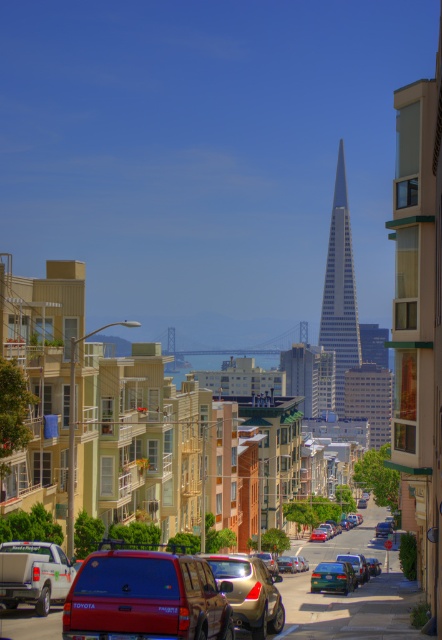
You are a delivery driver needing to park your van between the green matte pickup truck at lower left and the metallic silver car at center. Given that your van is 6 meters long, can you fit it between them without moving either vehicle?

The distance between the green matte pickup truck at lower left and the metallic silver car at center is 31.82 meters. Since your van is only 6 meters long, there is ample space to park it between them without needing to move either vehicle.

You are a delivery driver who needs to park your vehicle between the green matte pickup truck at lower left and the metallic silver car at center. Considering their heights, which vehicle should you position your delivery van closer to in order to avoid blocking the view of pedestrians?

The green matte pickup truck at lower left has a lesser height compared to metallic silver car at center. To avoid blocking the view of pedestrians, position your delivery van closer to the green matte pickup truck at lower left since it is shorter, allowing pedestrians to see around it better.

You are a pedestrian standing at the corner of the street. You want to cross to the other side but need to ensure there is enough space between the green matte pickup truck at lower left and the metallic silver sedan at center for a bicycle to pass through. Can you confirm if the space between them allows a bicycle to pass?

The green matte pickup truck at lower left is in front of the metallic silver sedan at center, meaning there is no space between them for a bicycle to pass.